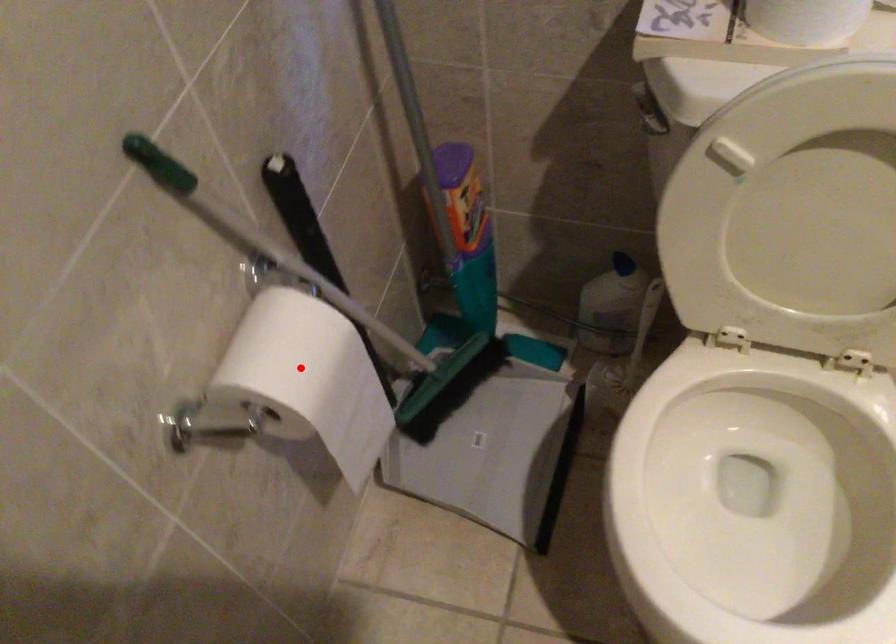
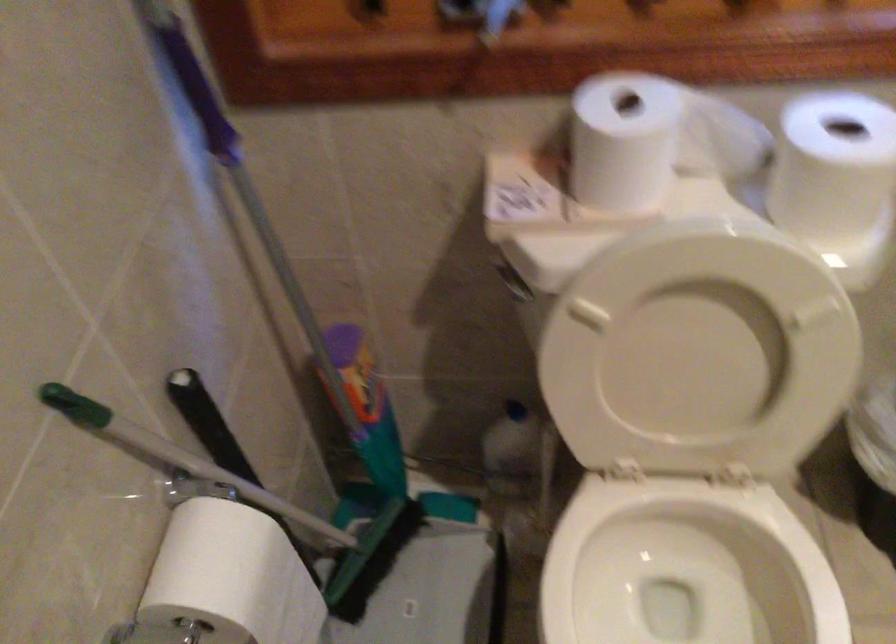
Where in the second image is the point corresponding to the highlighted location from the first image?

(231, 576)